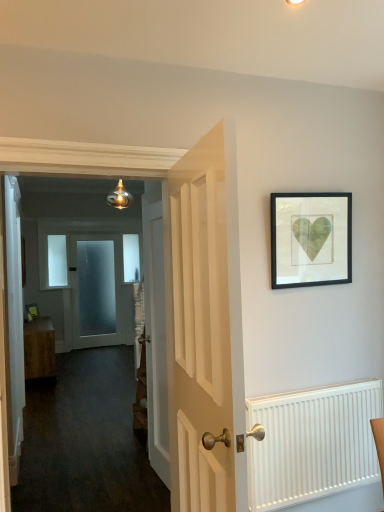
Question: Is frosted glass door at center, placed as the 1th door when sorted from left to right, at the right side of clear glass window at upper left, acting as the 2th window starting from the back?

Choices:
 (A) no
 (B) yes

Answer: (B)

Question: Is frosted glass door at center, placed as the 3th door when sorted from right to left, bigger than clear glass window at upper left, acting as the 2th window starting from the back?

Choices:
 (A) no
 (B) yes

Answer: (B)

Question: Does frosted glass door at center, placed as the 1th door when sorted from left to right, contain clear glass window at upper left, which appears as the 1th window when viewed from the front?

Choices:
 (A) yes
 (B) no

Answer: (B)

Question: Is frosted glass door at center, placed as the 1th door when sorted from left to right, facing towards clear glass window at upper left, which appears as the 1th window when viewed from the front?

Choices:
 (A) no
 (B) yes

Answer: (A)

Question: Considering the relative positions of frosted glass door at center, acting as the third door starting from the front, and clear glass window at upper left, the 2th window from the right, in the image provided, is frosted glass door at center, acting as the third door starting from the front, to the left of clear glass window at upper left, the 2th window from the right, from the viewer's perspective?

Choices:
 (A) yes
 (B) no

Answer: (B)

Question: Considering the relative positions of frosted glass door at center, the 1th door in the back-to-front sequence, and white wooden door at center, arranged as the third door when viewed from the back, in the image provided, is frosted glass door at center, the 1th door in the back-to-front sequence, to the left or to the right of white wooden door at center, arranged as the third door when viewed from the back,?

Choices:
 (A) left
 (B) right

Answer: (A)

Question: Is frosted glass door at center, the 1th door in the back-to-front sequence, inside or outside of white wooden door at center, marked as the 3th door in a left-to-right arrangement?

Choices:
 (A) inside
 (B) outside

Answer: (B)

Question: Is frosted glass door at center, placed as the 1th door when sorted from left to right, bigger or smaller than white wooden door at center, the first door positioned from the front?

Choices:
 (A) small
 (B) big

Answer: (A)

Question: Looking at their shapes, would you say frosted glass door at center, placed as the 3th door when sorted from right to left, is wider or thinner than white wooden door at center, marked as the 3th door in a left-to-right arrangement?

Choices:
 (A) thin
 (B) wide

Answer: (A)

Question: Looking at their shapes, would you say smooth white door at center is wider or thinner than white ribbed radiator at lower right?

Choices:
 (A) wide
 (B) thin

Answer: (A)

Question: Is smooth white door at center inside the boundaries of white ribbed radiator at lower right, or outside?

Choices:
 (A) outside
 (B) inside

Answer: (A)

Question: Is smooth white door at center taller or shorter than white ribbed radiator at lower right?

Choices:
 (A) tall
 (B) short

Answer: (A)

Question: Looking at the image, does smooth white door at center seem bigger or smaller compared to white ribbed radiator at lower right?

Choices:
 (A) small
 (B) big

Answer: (B)

Question: From a real-world perspective, relative to clear glass window at upper left, the 2th window from the right, is smooth white door at center vertically above or below?

Choices:
 (A) below
 (B) above

Answer: (A)

Question: Considering the positions of point (61, 465) and point (56, 272), is point (61, 465) closer or farther from the camera than point (56, 272)?

Choices:
 (A) farther
 (B) closer

Answer: (B)